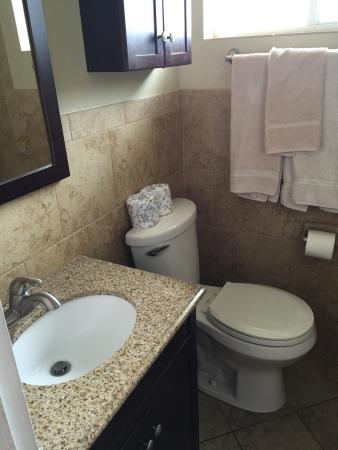
Locate an element on the screen. The image size is (338, 450). toilet sink is located at coordinates (81, 327).